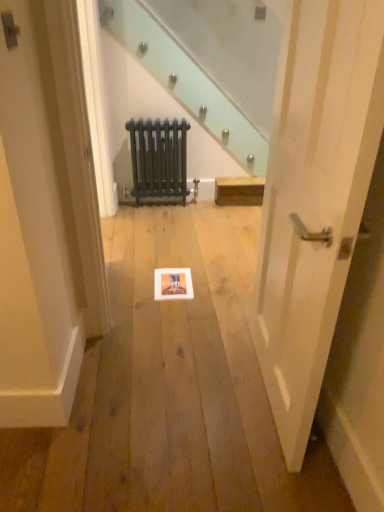
Question: Considering the positions of point (281, 186) and point (170, 150), is point (281, 186) closer or farther from the camera than point (170, 150)?

Choices:
 (A) farther
 (B) closer

Answer: (B)

Question: From a real-world perspective, is white wood door at center physically located above or below matte black radiator at center?

Choices:
 (A) below
 (B) above

Answer: (B)

Question: Choose the correct answer: Is white wood door at center inside matte black radiator at center or outside it?

Choices:
 (A) outside
 (B) inside

Answer: (A)

Question: From a real-world perspective, is matte black radiator at center above or below white wood door at center?

Choices:
 (A) below
 (B) above

Answer: (A)

Question: In the image, is matte black radiator at center positioned in front of or behind white wood door at center?

Choices:
 (A) front
 (B) behind

Answer: (B)

Question: Considering the positions of point (183, 160) and point (317, 48), is point (183, 160) closer or farther from the camera than point (317, 48)?

Choices:
 (A) farther
 (B) closer

Answer: (A)

Question: Considering the positions of matte black radiator at center and white wood door at center in the image, is matte black radiator at center bigger or smaller than white wood door at center?

Choices:
 (A) small
 (B) big

Answer: (A)